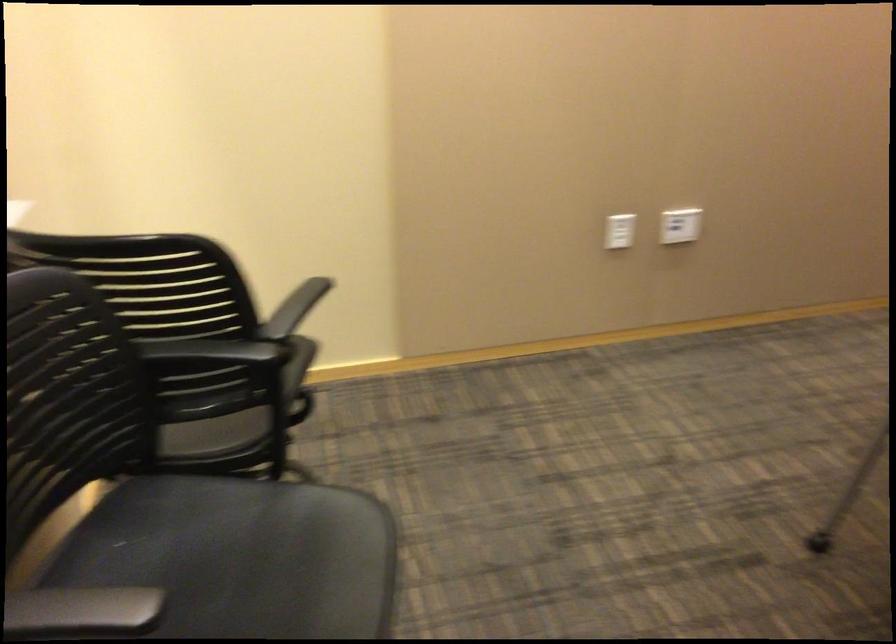
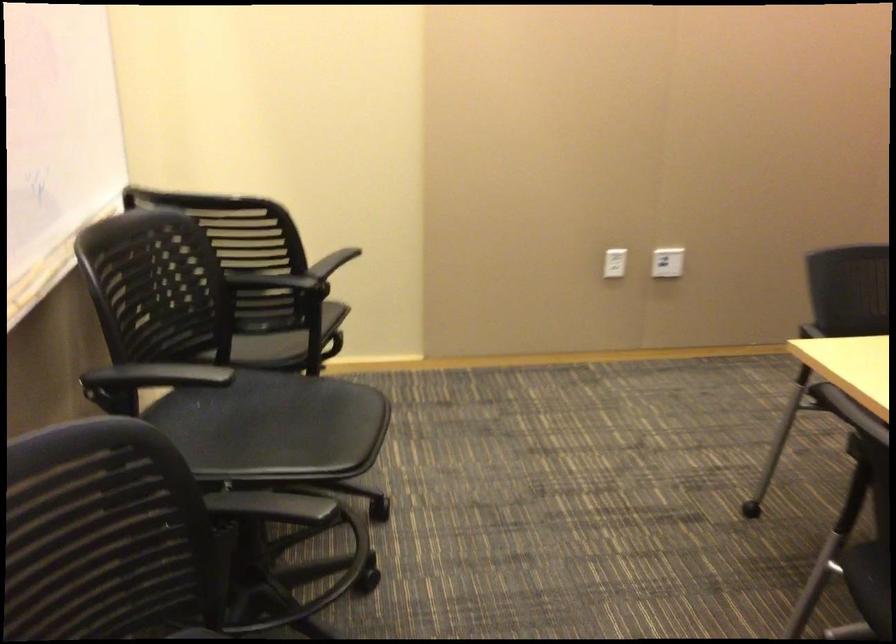
Question: How did the camera likely rotate?

Choices:
 (A) Left
 (B) Right
 (C) Up
 (D) Down

Answer: (C)